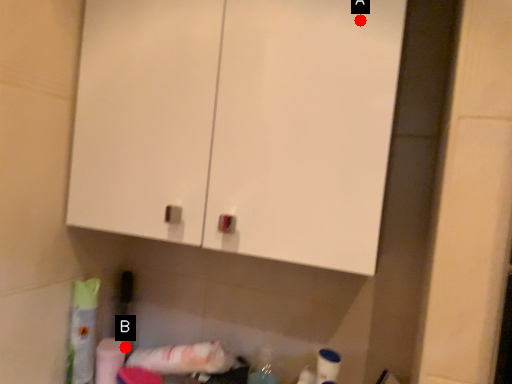
Question: Two points are circled on the image, labeled by A and B beside each circle. Which point is farther to the camera?

Choices:
 (A) A is further
 (B) B is further

Answer: (B)